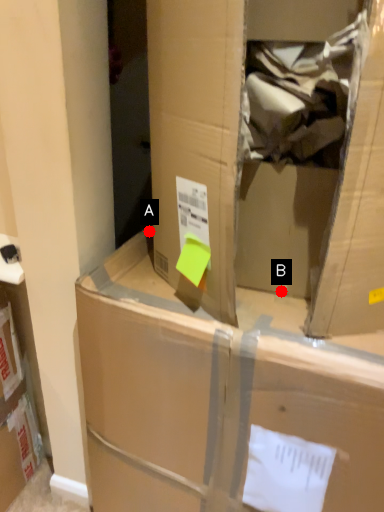
Question: Two points are circled on the image, labeled by A and B beside each circle. Which point appears farthest from the camera in this image?

Choices:
 (A) A is further
 (B) B is further

Answer: (A)